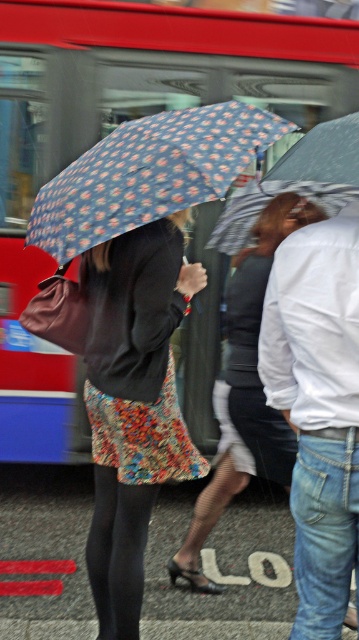
You are standing at the location where the viewer is positioned in the image. You need to board the red metallic bus at upper left. Can you reach the bus within 5 meters without moving from your current position?

The red metallic bus at upper left is 4.11 meters away from the viewer, so yes, you can reach it within 5 meters without moving from your current position.